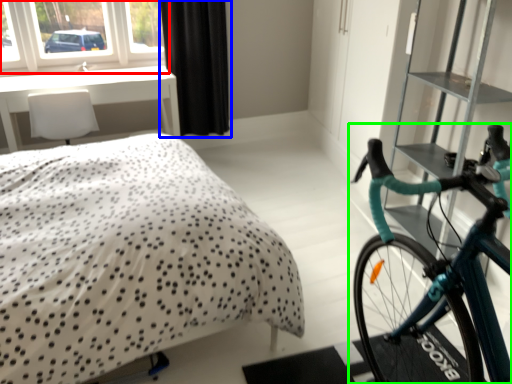
Question: Which is nearer to the window (highlighted by a red box)? curtain (highlighted by a blue box) or bicycle (highlighted by a green box).

Choices:
 (A) curtain
 (B) bicycle

Answer: (A)